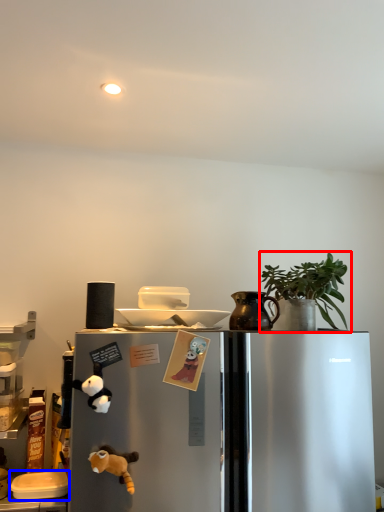
Question: Which object appears closest to the camera in this image, houseplant (highlighted by a red box) or appliance (highlighted by a blue box)?

Choices:
 (A) houseplant
 (B) appliance

Answer: (A)